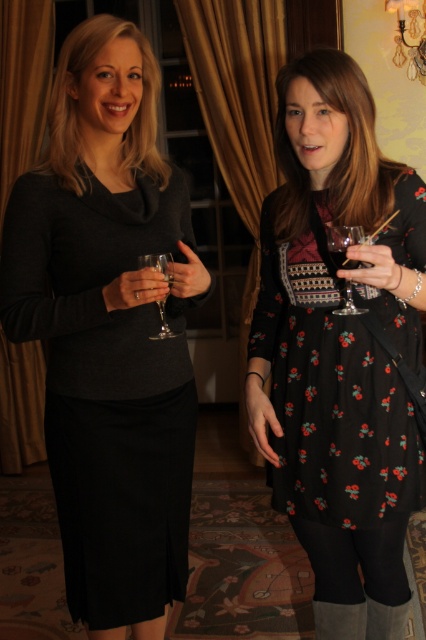
From the picture: You are a photographer at a social event. You need to capture a closeup of the printed cotton dress at center and the transparent glass at right. Which object will appear wider in the photo?

The printed cotton dress at center will appear wider in the photo because its width is larger than that of the transparent glass at right.

Looking at this image, you are at a party and need to hand a small gift to the printed cotton dress at center and the transparent glass at right. Which one can you reach without moving your position?

The transparent glass at right can be reached without moving because it is shorter than the printed cotton dress at center, which is much taller.